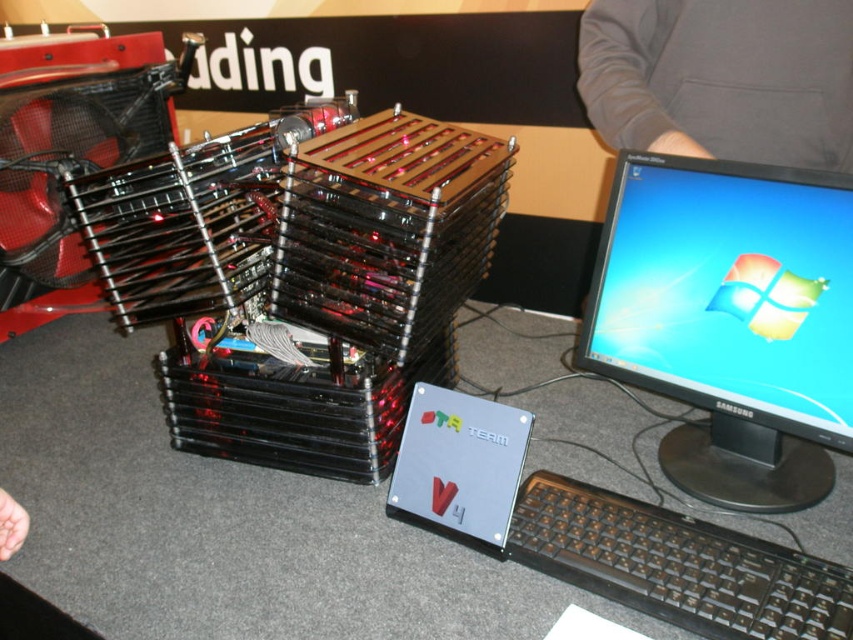
Is matte plastic monitor at right thinner than gray fabric sleeve at upper right?

Yes, matte plastic monitor at right is thinner than gray fabric sleeve at upper right.

In the scene shown: Can you confirm if matte plastic monitor at right is wider than gray fabric sleeve at upper right?

Incorrect, matte plastic monitor at right's width does not surpass gray fabric sleeve at upper right's.

Who is more forward, (732,314) or (581,72)?

Positioned in front is point (732,314).

Locate an element on the screen. The height and width of the screenshot is (640, 853). matte plastic monitor at right is located at coordinates (728, 291).

Which is behind, point (473, 451) or point (654, 68)?

The point (654, 68) is behind.

Does silver metallic hard drive at center have a lesser width compared to gray fabric sleeve at upper right?

No.

What do you see at coordinates (601, 531) in the screenshot? I see `silver metallic hard drive at center` at bounding box center [601, 531].

Locate an element on the screen. The width and height of the screenshot is (853, 640). silver metallic hard drive at center is located at coordinates click(x=601, y=531).

Does point (669, 310) lie behind point (627, 598)?

That is True.

Image resolution: width=853 pixels, height=640 pixels. Find the location of `matte plastic monitor at right`. matte plastic monitor at right is located at coordinates (728, 291).

Identify the location of matte plastic monitor at right. The width and height of the screenshot is (853, 640). pyautogui.click(x=728, y=291).